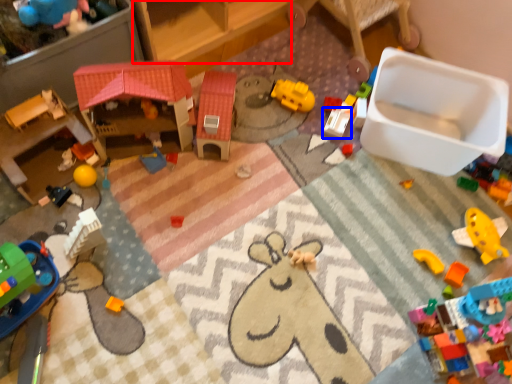
Question: Which of the following is the closest to the observer, furniture (highlighted by a red box) or toy (highlighted by a blue box)?

Choices:
 (A) furniture
 (B) toy

Answer: (A)